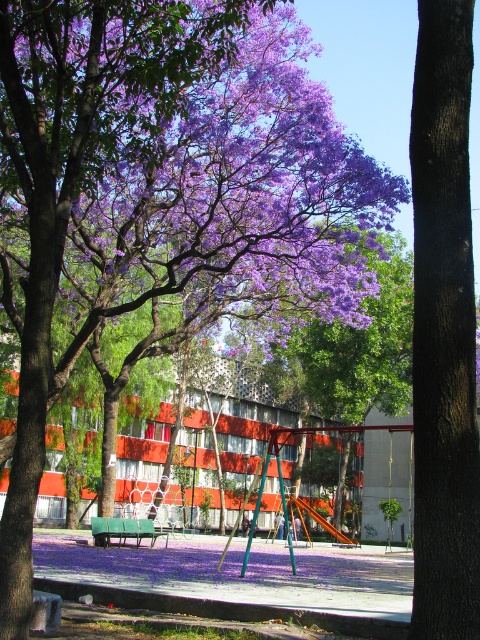
You are a visitor at the park and want to sit on the green plastic bench at center while still having a clear view of the purple matte tree at center. Is the bench positioned in a way that allows you to see the tree without obstruction?

The purple matte tree at center is to the right of the green plastic bench at center, so sitting on the bench would allow you to see the tree to your right without obstruction as there are no objects mentioned blocking the view.

You are a child who is 1.2 meters tall standing in front of the brown rough bark tree at center. If you want to reach the lowest branch of the tree, which is at 1.5 meters height, can you do it while standing on the ground?

The brown rough bark tree at center is 4.20 meters away from you. Since the lowest branch is at 1.5 meters height and you are 1.2 meters tall, you cannot reach it while standing on the ground because the branch is slightly higher than your height.